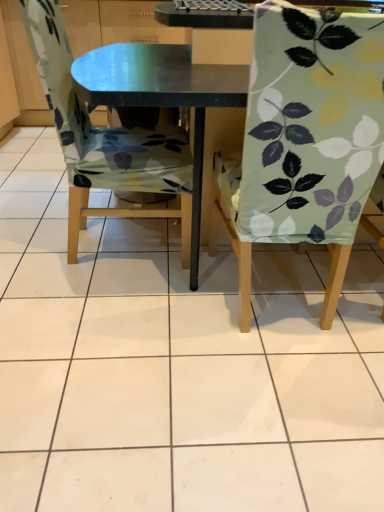
The height and width of the screenshot is (512, 384). In order to click on floral fabric chair at left, the first chair from the left in this screenshot , I will do 104,137.

Measure the distance between floral fabric chair at left, the first chair from the left, and camera.

floral fabric chair at left, the first chair from the left, is 4.15 feet from camera.

How much space does floral fabric chair at left, which ranks as the second chair in right-to-left order, occupy horizontally?

floral fabric chair at left, which ranks as the second chair in right-to-left order, is 22.73 inches in width.

Describe the element at coordinates (104, 137) in the screenshot. This screenshot has height=512, width=384. I see `floral fabric chair at left, which ranks as the second chair in right-to-left order` at that location.

What do you see at coordinates (308, 138) in the screenshot? I see `light green fabric chair at right, the 1th chair from the right` at bounding box center [308, 138].

Identify the location of light green fabric chair at right, the second chair in the left-to-right sequence. (308, 138).

I want to click on floral fabric chair at left, the first chair from the left, so click(104, 137).

Considering the relative positions of floral fabric chair at left, the first chair from the left, and light green fabric chair at right, the 1th chair from the right, in the image provided, is floral fabric chair at left, the first chair from the left, to the right of light green fabric chair at right, the 1th chair from the right, from the viewer's perspective?

No.

Between floral fabric chair at left, which ranks as the second chair in right-to-left order, and light green fabric chair at right, the second chair in the left-to-right sequence, which one is positioned in front?

light green fabric chair at right, the second chair in the left-to-right sequence, is in front.

Which is closer, (84,127) or (377,52)?

Point (84,127).

Consider the image. From the image's perspective, between floral fabric chair at left, the first chair from the left, and light green fabric chair at right, the 1th chair from the right, which one is located above?

floral fabric chair at left, the first chair from the left, is shown above in the image.

From a real-world perspective, which object rests below the other?

floral fabric chair at left, the first chair from the left, from a real-world perspective.

Which of these two, floral fabric chair at left, which ranks as the second chair in right-to-left order, or light green fabric chair at right, the second chair in the left-to-right sequence, is wider?

floral fabric chair at left, which ranks as the second chair in right-to-left order.

Which of these two, floral fabric chair at left, which ranks as the second chair in right-to-left order, or light green fabric chair at right, the 1th chair from the right, stands shorter?

floral fabric chair at left, which ranks as the second chair in right-to-left order.

In terms of size, does floral fabric chair at left, the first chair from the left, appear bigger or smaller than light green fabric chair at right, the second chair in the left-to-right sequence?

floral fabric chair at left, the first chair from the left, is bigger than light green fabric chair at right, the second chair in the left-to-right sequence.

Is floral fabric chair at left, the first chair from the left, outside of light green fabric chair at right, the 1th chair from the right?

Yes, floral fabric chair at left, the first chair from the left, is located beyond the bounds of light green fabric chair at right, the 1th chair from the right.

Is floral fabric chair at left, the first chair from the left, not close to light green fabric chair at right, the 1th chair from the right?

floral fabric chair at left, the first chair from the left, is actually quite close to light green fabric chair at right, the 1th chair from the right.

Is floral fabric chair at left, which ranks as the second chair in right-to-left order, facing away from light green fabric chair at right, the 1th chair from the right?

floral fabric chair at left, which ranks as the second chair in right-to-left order, is not turned away from light green fabric chair at right, the 1th chair from the right.

How different are the orientations of floral fabric chair at left, which ranks as the second chair in right-to-left order, and light green fabric chair at right, the 1th chair from the right, in degrees?

92.1 degrees.

Measure the distance between floral fabric chair at left, the first chair from the left, and light green fabric chair at right, the second chair in the left-to-right sequence.

floral fabric chair at left, the first chair from the left, is 23.57 inches from light green fabric chair at right, the second chair in the left-to-right sequence.

Where is `chair below the light green fabric chair at right, the second chair in the left-to-right sequence (from a real-world perspective)`? The height and width of the screenshot is (512, 384). chair below the light green fabric chair at right, the second chair in the left-to-right sequence (from a real-world perspective) is located at coordinates (104, 137).

Which object is positioned more to the left, light green fabric chair at right, the 1th chair from the right, or floral fabric chair at left, which ranks as the second chair in right-to-left order?

floral fabric chair at left, which ranks as the second chair in right-to-left order, is more to the left.

Relative to floral fabric chair at left, the first chair from the left, is light green fabric chair at right, the second chair in the left-to-right sequence, in front or behind?

In the image, light green fabric chair at right, the second chair in the left-to-right sequence, appears in front of floral fabric chair at left, the first chair from the left.

Does point (308, 135) come in front of point (29, 12)?

Yes, point (308, 135) is in front of point (29, 12).

From the image's perspective, is light green fabric chair at right, the 1th chair from the right, beneath floral fabric chair at left, which ranks as the second chair in right-to-left order?

Yes, from the image's perspective, light green fabric chair at right, the 1th chair from the right, is beneath floral fabric chair at left, which ranks as the second chair in right-to-left order.

From a real-world perspective, which object rests below the other?

In real-world perspective, floral fabric chair at left, the first chair from the left, is lower.

Is light green fabric chair at right, the second chair in the left-to-right sequence, wider than floral fabric chair at left, the first chair from the left?

In fact, light green fabric chair at right, the second chair in the left-to-right sequence, might be narrower than floral fabric chair at left, the first chair from the left.

Between light green fabric chair at right, the second chair in the left-to-right sequence, and floral fabric chair at left, which ranks as the second chair in right-to-left order, which one has less height?

With less height is floral fabric chair at left, which ranks as the second chair in right-to-left order.

Is light green fabric chair at right, the 1th chair from the right, bigger or smaller than floral fabric chair at left, the first chair from the left?

light green fabric chair at right, the 1th chair from the right, is smaller than floral fabric chair at left, the first chair from the left.

Choose the correct answer: Is light green fabric chair at right, the 1th chair from the right, inside floral fabric chair at left, which ranks as the second chair in right-to-left order, or outside it?

The correct answer is: outside.

Is light green fabric chair at right, the second chair in the left-to-right sequence, far from floral fabric chair at left, the first chair from the left?

No, light green fabric chair at right, the second chair in the left-to-right sequence, is not far from floral fabric chair at left, the first chair from the left.

Could you tell me if light green fabric chair at right, the second chair in the left-to-right sequence, is turned towards floral fabric chair at left, the first chair from the left?

No, light green fabric chair at right, the second chair in the left-to-right sequence, is not turned towards floral fabric chair at left, the first chair from the left.

Find the location of a particular element. chair in front of the floral fabric chair at left, the first chair from the left is located at coordinates (308, 138).

You are a GUI agent. You are given a task and a screenshot of the screen. Output one action in this format:
    pyautogui.click(x=<x>, y=<y>)
    Task: Click on the chair located underneath the light green fabric chair at right, the second chair in the left-to-right sequence (from a real-world perspective)
    Image resolution: width=384 pixels, height=512 pixels.
    Given the screenshot: What is the action you would take?
    pyautogui.click(x=104, y=137)

Locate an element on the screen. This screenshot has width=384, height=512. chair that is on the right side of floral fabric chair at left, the first chair from the left is located at coordinates (308, 138).